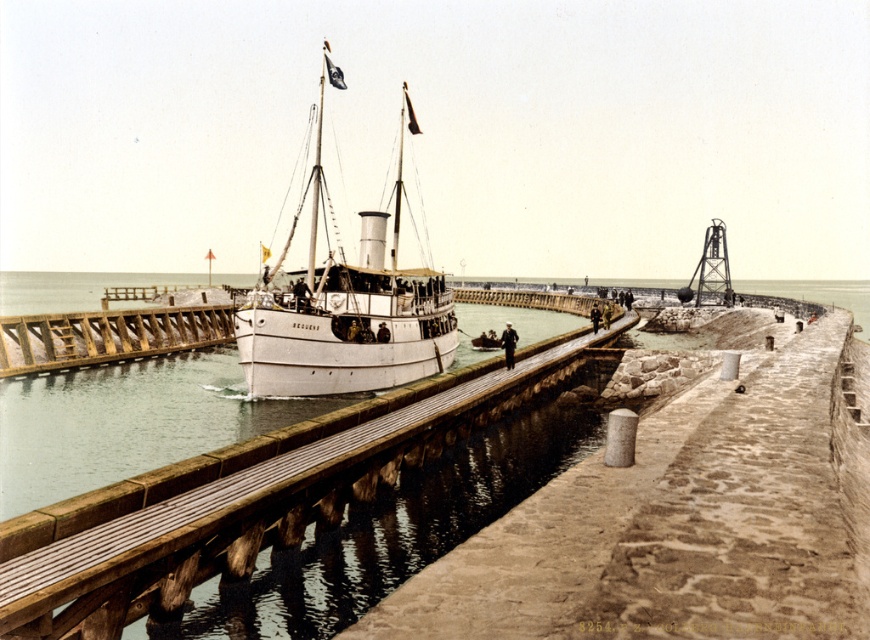
Question: Which object appears closest to the camera in this image?

Choices:
 (A) wooden at center
 (B) white matte ship at center
 (C) wooden at left

Answer: (A)

Question: Does wooden at center come in front of wooden at left?

Choices:
 (A) no
 (B) yes

Answer: (B)

Question: Is white matte ship at center to the left of wooden at left from the viewer's perspective?

Choices:
 (A) yes
 (B) no

Answer: (B)

Question: Estimate the real-world distances between objects in this image. Which object is farther from the white matte ship at center?

Choices:
 (A) wooden at center
 (B) wooden at left

Answer: (A)

Question: Which object is farther from the camera taking this photo?

Choices:
 (A) white matte ship at center
 (B) wooden at left

Answer: (B)

Question: Does wooden at center have a greater width compared to white matte ship at center?

Choices:
 (A) no
 (B) yes

Answer: (A)